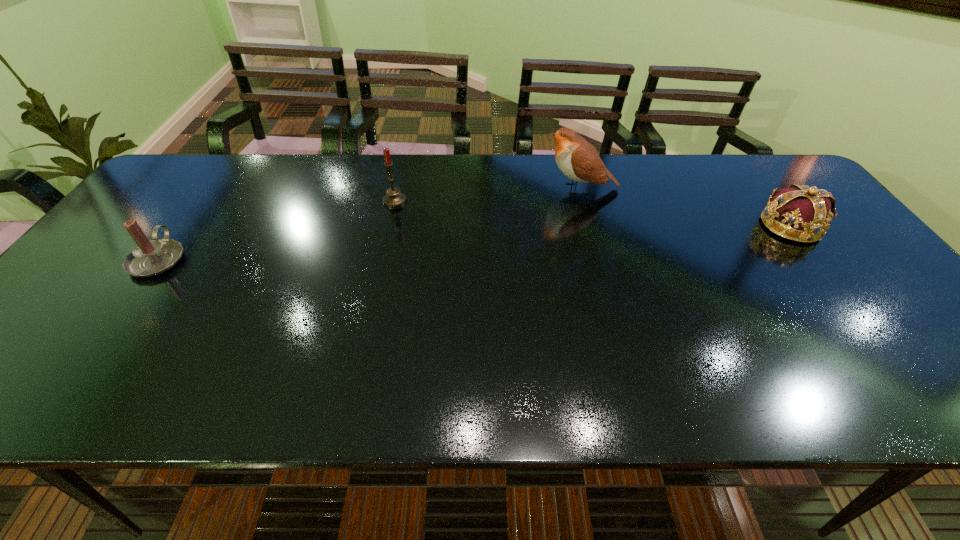
At what (x,y) coordinates should I click in order to perform the action: click on the third object from left to right. Please return your answer as a coordinate pair (x, y). Image resolution: width=960 pixels, height=540 pixels. Looking at the image, I should click on (577, 159).

Image resolution: width=960 pixels, height=540 pixels. What are the coordinates of `the farther candle` in the screenshot? It's located at (394, 198).

The image size is (960, 540). Find the location of `the taller candle`. the taller candle is located at coordinates (394, 198).

I want to click on the leftmost object, so click(150, 257).

Find the location of `the nearer candle`. the nearer candle is located at coordinates 150,257.

Find the location of a particular element. This screenshot has width=960, height=540. the rightmost object is located at coordinates (802, 213).

The image size is (960, 540). In order to click on vacant space located 0.360m at the face of the bird in this screenshot , I will do `click(423, 188)`.

Image resolution: width=960 pixels, height=540 pixels. In order to click on vacant space located at the face of the bird in this screenshot , I will do `click(510, 188)`.

Where is `free location located 0.360m at the face of the bird`? The width and height of the screenshot is (960, 540). free location located 0.360m at the face of the bird is located at coordinates (423, 188).

Where is `free spot located on the back of the right candle`? free spot located on the back of the right candle is located at coordinates (402, 165).